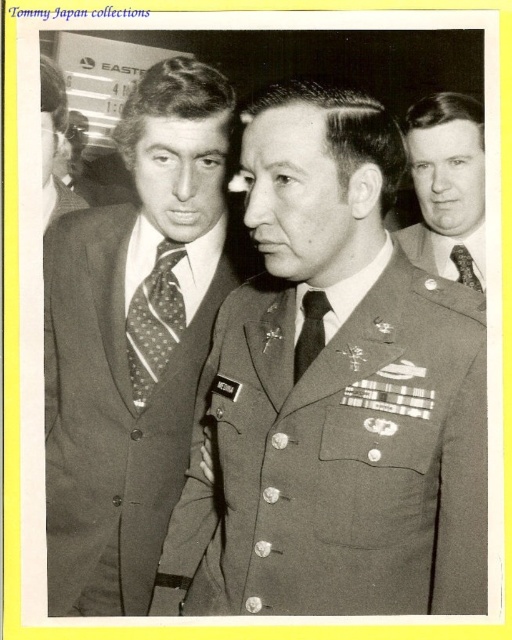
Based on the photo, you are standing at the origin point of the image. There is a point at coordinates point (134, 340). What object is located at that point?

The polished dark suit at center is located at point (134, 340).